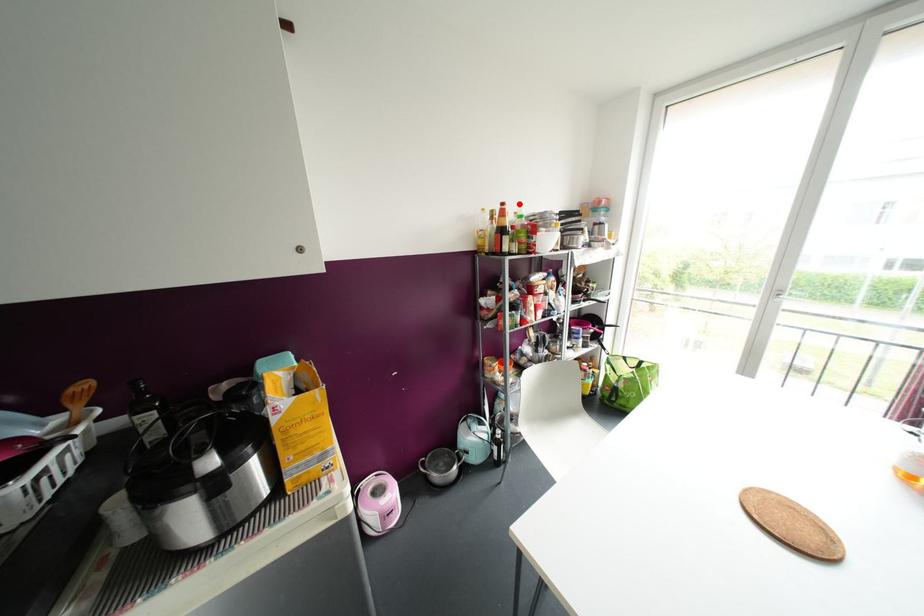
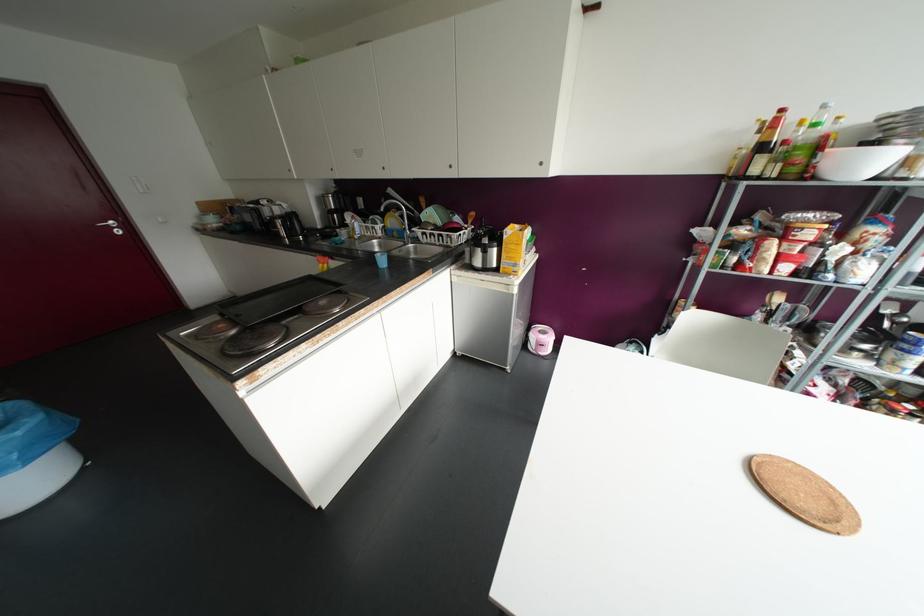
Question: A red point is marked in image1. In image2, is the corresponding 3D point closer to the camera or farther? Reply with the corresponding letter.

Choices:
 (A) The corresponding 3D point is closer.
 (B) The corresponding 3D point is farther.

Answer: (B)